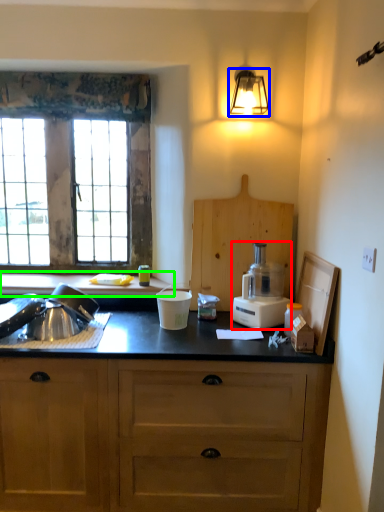
Question: Estimate the real-world distances between objects in this image. Which object is farther from kitchen appliance (highlighted by a red box), light fixture (highlighted by a blue box) or countertop (highlighted by a green box)?

Choices:
 (A) light fixture
 (B) countertop

Answer: (A)